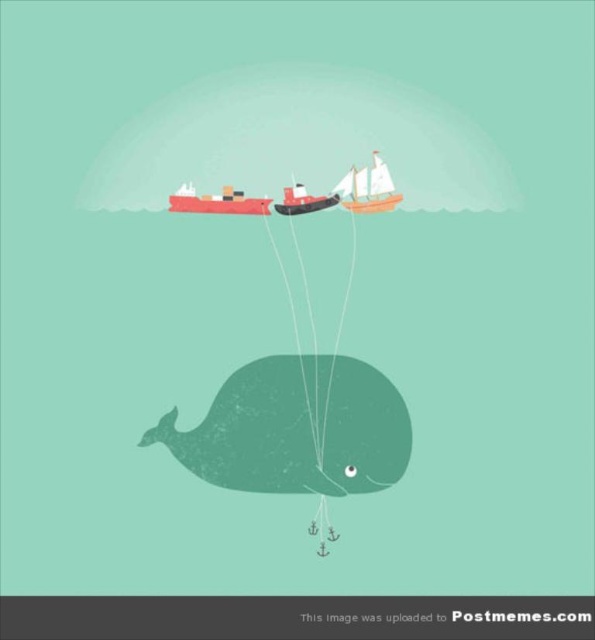
You are standing at point (389, 192). The whale is holding ropes attached to a red tugboat and a larger sailboat. If you want to reach the closest boat, which one should you go to?

The red tugboat is closer to point (389, 192) than the sailboat, so you should go to the red tugboat.

You are a sailor trying to board the closest vessel to the whale. Which vessel should you choose between the matte red cargo ship at upper center and the smooth wood boat at upper center?

The matte red cargo ship at upper center has a lesser height compared to the smooth wood boat at upper center, so the matte red cargo ship at upper center is closer to the whale and should be chosen.